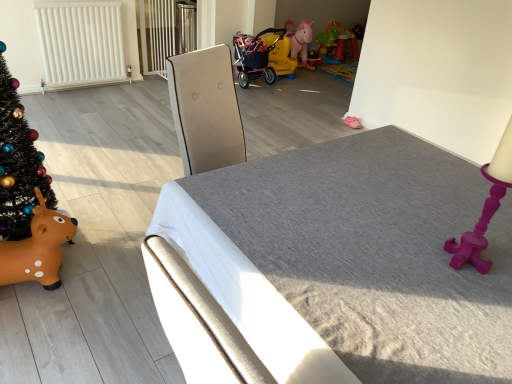
Question: Does yellow plastic stroller at center, the third toy when ordered from right to left, have a greater width compared to textured gray mattress at center?

Choices:
 (A) no
 (B) yes

Answer: (A)

Question: Is yellow plastic stroller at center, acting as the second toy starting from the left, facing away from textured gray mattress at center?

Choices:
 (A) yes
 (B) no

Answer: (B)

Question: Can you confirm if yellow plastic stroller at center, the third toy when ordered from right to left, is positioned to the right of textured gray mattress at center?

Choices:
 (A) no
 (B) yes

Answer: (A)

Question: From the image's perspective, is yellow plastic stroller at center, which ranks as the 2th toy in front-to-back order, on textured gray mattress at center?

Choices:
 (A) yes
 (B) no

Answer: (A)

Question: Considering the relative sizes of yellow plastic stroller at center, the third toy when ordered from right to left, and textured gray mattress at center in the image provided, is yellow plastic stroller at center, the third toy when ordered from right to left, bigger than textured gray mattress at center?

Choices:
 (A) no
 (B) yes

Answer: (A)

Question: Is yellow plastic stroller at center, marked as the second toy in a bottom-to-top arrangement, inside or outside of yellow plastic stroller at center, the second toy positioned from the right?

Choices:
 (A) inside
 (B) outside

Answer: (B)

Question: Considering the positions of point (293, 64) and point (285, 61), is point (293, 64) closer or farther from the camera than point (285, 61)?

Choices:
 (A) farther
 (B) closer

Answer: (A)

Question: Considering the relative positions of yellow plastic stroller at center, the third toy when ordered from right to left, and yellow plastic stroller at center, the 3th toy viewed from the left, in the image provided, is yellow plastic stroller at center, the third toy when ordered from right to left, to the left or to the right of yellow plastic stroller at center, the 3th toy viewed from the left,?

Choices:
 (A) right
 (B) left

Answer: (B)

Question: Considering the positions of yellow plastic stroller at center, the 3th toy from the back, and yellow plastic stroller at center, the 2th toy from the top, in the image, is yellow plastic stroller at center, the 3th toy from the back, taller or shorter than yellow plastic stroller at center, the 2th toy from the top,?

Choices:
 (A) short
 (B) tall

Answer: (B)

Question: Based on their sizes in the image, would you say yellow plastic stroller at center, placed as the 3th toy when sorted from bottom to top, is bigger or smaller than brown rubber reindeer at lower left, which is counted as the 1th toy, starting from the front?

Choices:
 (A) big
 (B) small

Answer: (A)

Question: From their relative heights in the image, would you say yellow plastic stroller at center, the second toy positioned from the right, is taller or shorter than brown rubber reindeer at lower left, the fourth toy in the back-to-front sequence?

Choices:
 (A) short
 (B) tall

Answer: (A)

Question: Is yellow plastic stroller at center, the 2th toy from the top, inside or outside of brown rubber reindeer at lower left, which is counted as the 1th toy, starting from the front?

Choices:
 (A) inside
 (B) outside

Answer: (B)

Question: From the image's perspective, is yellow plastic stroller at center, the 2th toy from the top, located above or below brown rubber reindeer at lower left, which is counted as the 1th toy, starting from the front?

Choices:
 (A) below
 (B) above

Answer: (B)

Question: From the image's perspective, relative to black matte christmas tree at left, is yellow plastic stroller at center, the third toy positioned from the top, above or below?

Choices:
 (A) below
 (B) above

Answer: (B)

Question: From a real-world perspective, is yellow plastic stroller at center, marked as the second toy in a bottom-to-top arrangement, physically located above or below black matte christmas tree at left?

Choices:
 (A) below
 (B) above

Answer: (A)